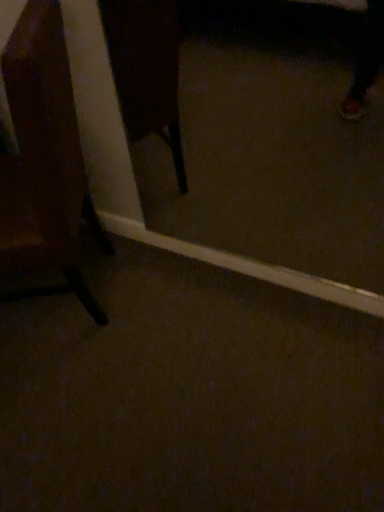
Identify the location of wooden chair at left. (44, 160).

What is the approximate height of wooden chair at left?

95.87 centimeters.

What do you see at coordinates (44, 160) in the screenshot? I see `wooden chair at left` at bounding box center [44, 160].

Image resolution: width=384 pixels, height=512 pixels. I want to click on transparent glass door at center, so click(x=270, y=153).

Describe the element at coordinates (270, 153) in the screenshot. This screenshot has width=384, height=512. I see `transparent glass door at center` at that location.

Find the location of a particular element. The height and width of the screenshot is (512, 384). wooden chair at left is located at coordinates (44, 160).

Considering the positions of objects transparent glass door at center and wooden chair at left in the image provided, who is more to the left, transparent glass door at center or wooden chair at left?

wooden chair at left is more to the left.

Is transparent glass door at center behind wooden chair at left?

That is True.

Does point (292, 236) come closer to viewer compared to point (35, 3)?

No, (292, 236) is further to viewer.

From the image's perspective, which is below, transparent glass door at center or wooden chair at left?

wooden chair at left.

From a real-world perspective, is transparent glass door at center beneath wooden chair at left?

No.

Considering the sizes of objects transparent glass door at center and wooden chair at left in the image provided, who is thinner, transparent glass door at center or wooden chair at left?

transparent glass door at center.

Which of these two, transparent glass door at center or wooden chair at left, stands shorter?

transparent glass door at center.

Which of these two, transparent glass door at center or wooden chair at left, is bigger?

With larger size is wooden chair at left.

Which is correct: transparent glass door at center is inside wooden chair at left, or outside of it?

transparent glass door at center cannot be found inside wooden chair at left.

Is transparent glass door at center touching wooden chair at left?

They are not placed beside each other.

Is transparent glass door at center facing towards wooden chair at left?

No, transparent glass door at center is not turned towards wooden chair at left.

What's the angular difference between transparent glass door at center and wooden chair at left's facing directions?

transparent glass door at center and wooden chair at left are facing 63.7 degrees away from each other.

At what (x,y) coordinates should I click in order to perform the action: click on chair that is in front of the transparent glass door at center. Please return your answer as a coordinate pair (x, y). The height and width of the screenshot is (512, 384). Looking at the image, I should click on (44, 160).

Does wooden chair at left appear on the right side of transparent glass door at center?

No.

Between wooden chair at left and transparent glass door at center, which one is positioned in front?

wooden chair at left.

Is point (43, 214) positioned before point (246, 2)?

Yes, it is in front of point (246, 2).

From the image's perspective, is wooden chair at left located above transparent glass door at center?

Actually, wooden chair at left appears below transparent glass door at center in the image.

From a real-world perspective, is wooden chair at left located higher than transparent glass door at center?

Actually, wooden chair at left is physically below transparent glass door at center in the real world.

Can you confirm if wooden chair at left is wider than transparent glass door at center?

Yes.

From the picture: Does wooden chair at left have a greater height compared to transparent glass door at center?

Yes.

Between wooden chair at left and transparent glass door at center, which one has larger size?

wooden chair at left is bigger.

Based on the photo, would you say wooden chair at left is inside or outside transparent glass door at center?

wooden chair at left exists outside the volume of transparent glass door at center.

Are wooden chair at left and transparent glass door at center located far from each other?

wooden chair at left is positioned a significant distance from transparent glass door at center.

Is wooden chair at left looking in the opposite direction of transparent glass door at center?

Yes.

Where is `glass door on the right of wooden chair at left`? glass door on the right of wooden chair at left is located at coordinates (270, 153).

The height and width of the screenshot is (512, 384). I want to click on chair to the left of transparent glass door at center, so click(x=44, y=160).

Where is `chair below the transparent glass door at center (from the image's perspective)`? The width and height of the screenshot is (384, 512). chair below the transparent glass door at center (from the image's perspective) is located at coordinates (44, 160).